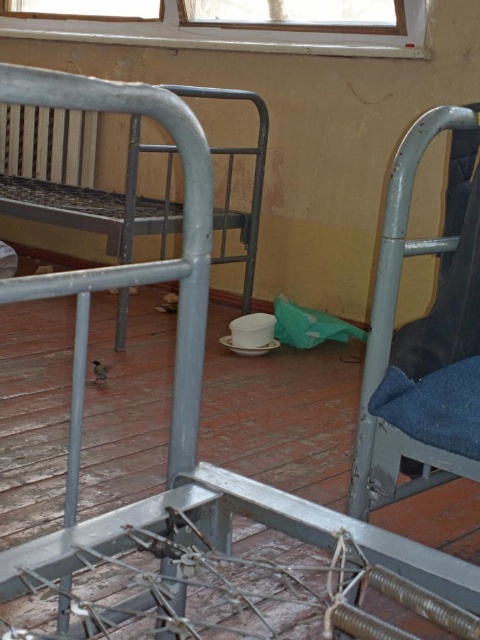
You are a guest in this room and want to sit in a spot where you can see both the blue fabric chair at right and the wooden frame window at upper center. Which object should you position yourself closer to in order to have both in your field of view?

The blue fabric chair at right is positioned under the wooden frame window at upper center, so positioning yourself closer to the blue fabric chair at right will allow you to see both objects simultaneously.

Please describe the color and condition of the bed located at point [100,202] in the image.

The bed at point [100,202] is a metallic gray bed at left, which is partially visible with a mattress.

You are a delivery person standing at the point marked by the coordinate point at [120,237]. You need to place a package between the two beds. The package requires 3 meters of space. Is there enough space between the two beds to place the package?

The two beds are 2.76 meters apart, which is less than the required 3 meters. Therefore, there is not enough space to place the package between them.